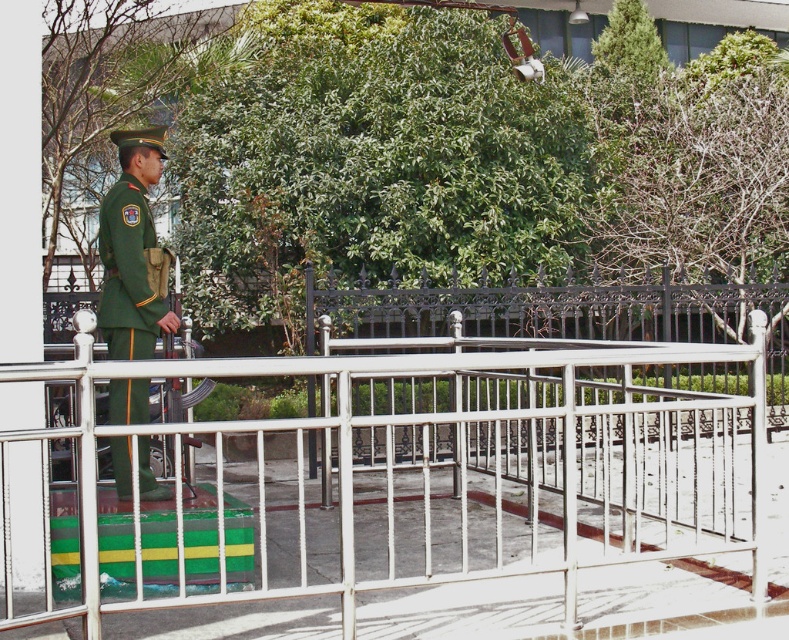
Can you confirm if white metal rail at center is shorter than green matte uniform at left?

Indeed, white metal rail at center has a lesser height compared to green matte uniform at left.

Who is more forward, [596,541] or [133,221]?

Point [133,221]

Is point (479, 365) behind point (126, 227)?

No, it is not.

This screenshot has width=789, height=640. Find the location of `white metal rail at center`. white metal rail at center is located at coordinates (402, 477).